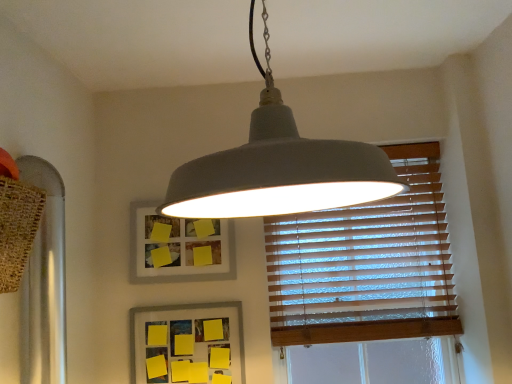
Describe the element at coordinates (177, 244) in the screenshot. I see `matte gray picture frame at upper center, which is the first picture frame in top-to-bottom order` at that location.

What do you see at coordinates (279, 169) in the screenshot? The height and width of the screenshot is (384, 512). I see `matte gray lampshade at center` at bounding box center [279, 169].

Image resolution: width=512 pixels, height=384 pixels. I want to click on matte gray picture frame at upper center, which is the second picture frame in bottom-to-top order, so click(177, 244).

Does matte gray picture frame at upper center, which is the first picture frame in top-to-bottom order, lie in front of matte gray lampshade at center?

No, the depth of matte gray picture frame at upper center, which is the first picture frame in top-to-bottom order, is greater than that of matte gray lampshade at center.

Between matte gray picture frame at upper center, which is the second picture frame in bottom-to-top order, and matte gray lampshade at center, which one has less height?

With less height is matte gray picture frame at upper center, which is the second picture frame in bottom-to-top order.

Is matte gray lampshade at center inside matte gray picture frame at upper center, which is the second picture frame in bottom-to-top order?

No, matte gray lampshade at center is located outside of matte gray picture frame at upper center, which is the second picture frame in bottom-to-top order.

Is wooden blinds at upper right shorter than yellow paper at lower center, the 2th picture frame positioned from the top?

In fact, wooden blinds at upper right may be taller than yellow paper at lower center, the 2th picture frame positioned from the top.

Does wooden blinds at upper right turn towards yellow paper at lower center, which is the first picture frame from bottom to top?

No, wooden blinds at upper right is not aimed at yellow paper at lower center, which is the first picture frame from bottom to top.

From a real-world perspective, between wooden blinds at upper right and yellow paper at lower center, which is the first picture frame from bottom to top, who is vertically lower?

In real-world perspective, yellow paper at lower center, which is the first picture frame from bottom to top, is lower.

Can you tell me how much wooden blinds at upper right and yellow paper at lower center, the 2th picture frame positioned from the top, differ in facing direction?

The angular difference between wooden blinds at upper right and yellow paper at lower center, the 2th picture frame positioned from the top, is 0.257 degrees.

Is yellow paper at lower center, the 2th picture frame positioned from the top, located outside matte gray lampshade at center?

That's correct, yellow paper at lower center, the 2th picture frame positioned from the top, is outside of matte gray lampshade at center.

Which is closer to the camera, (158, 315) or (315, 143)?

The point (315, 143) is more forward.

Considering the sizes of objects yellow paper at lower center, which is the first picture frame from bottom to top, and matte gray lampshade at center in the image provided, who is wider, yellow paper at lower center, which is the first picture frame from bottom to top, or matte gray lampshade at center?

With larger width is matte gray lampshade at center.

Is wooden blinds at upper right smaller than matte gray picture frame at upper center, which is the first picture frame in top-to-bottom order?

Incorrect, wooden blinds at upper right is not smaller in size than matte gray picture frame at upper center, which is the first picture frame in top-to-bottom order.

How different are the orientations of wooden blinds at upper right and matte gray picture frame at upper center, which is the second picture frame in bottom-to-top order, in degrees?

wooden blinds at upper right and matte gray picture frame at upper center, which is the second picture frame in bottom-to-top order, are facing 0.314 degrees away from each other.

From a real-world perspective, is wooden blinds at upper right over matte gray picture frame at upper center, which is the first picture frame in top-to-bottom order?

Actually, wooden blinds at upper right is physically below matte gray picture frame at upper center, which is the first picture frame in top-to-bottom order, in the real world.

Is wooden blinds at upper right located outside matte gray picture frame at upper center, which is the first picture frame in top-to-bottom order?

Yes.

From the picture: From a real-world perspective, who is located lower, yellow paper at lower center, which is the first picture frame from bottom to top, or wooden blinds at upper right?

yellow paper at lower center, which is the first picture frame from bottom to top.

Does point (237, 381) come farther from viewer compared to point (373, 261)?

No, (237, 381) is in front of (373, 261).

Relative to wooden blinds at upper right, is yellow paper at lower center, the 2th picture frame positioned from the top, in front or behind?

yellow paper at lower center, the 2th picture frame positioned from the top, is positioned closer to the viewer than wooden blinds at upper right.

At what (x,y) coordinates should I click in order to perform the action: click on the 2nd picture frame in front of the wooden blinds at upper right, counting from the anchor's position. Please return your answer as a coordinate pair (x, y). Looking at the image, I should click on (187, 344).

Which picture frame is the 1st one when counting from the front of the wooden blinds at upper right? Please provide its 2D coordinates.

[(177, 244)]

Would you consider matte gray picture frame at upper center, which is the first picture frame in top-to-bottom order, to be distant from wooden blinds at upper right?

No, matte gray picture frame at upper center, which is the first picture frame in top-to-bottom order, is not far from wooden blinds at upper right.

Consider the image. Would you say matte gray picture frame at upper center, which is the second picture frame in bottom-to-top order, is to the left or to the right of wooden blinds at upper right in the picture?

matte gray picture frame at upper center, which is the second picture frame in bottom-to-top order, is to the left of wooden blinds at upper right.

Could you tell me if matte gray lampshade at center is turned towards yellow paper at lower center, the 2th picture frame positioned from the top?

No.

Between matte gray lampshade at center and yellow paper at lower center, the 2th picture frame positioned from the top, which one has more height?

Standing taller between the two is matte gray lampshade at center.

Can we say matte gray lampshade at center lies outside yellow paper at lower center, which is the first picture frame from bottom to top?

Yes, matte gray lampshade at center is outside of yellow paper at lower center, which is the first picture frame from bottom to top.

From a real-world perspective, count 1st picture frames downward from the matte gray lampshade at center and point to it. Please provide its 2D coordinates.

[(177, 244)]

Find the location of a particular element. The image size is (512, 384). window blind that appears above the yellow paper at lower center, the 2th picture frame positioned from the top (from a real-world perspective) is located at coordinates (x=366, y=264).

Which object lies nearer to the anchor point matte gray lampshade at center, yellow paper at lower center, which is the first picture frame from bottom to top, or wooden blinds at upper right?

wooden blinds at upper right lies closer to matte gray lampshade at center than the other object.

Looking at the image, which one is located closer to wooden blinds at upper right, matte gray lampshade at center or yellow paper at lower center, which is the first picture frame from bottom to top?

yellow paper at lower center, which is the first picture frame from bottom to top, lies closer to wooden blinds at upper right than the other object.

From the image, which object appears to be farther from yellow paper at lower center, the 2th picture frame positioned from the top, matte gray lampshade at center or wooden blinds at upper right?

Among the two, matte gray lampshade at center is located further to yellow paper at lower center, the 2th picture frame positioned from the top.

In the scene shown: From the image, which object appears to be nearer to yellow paper at lower center, the 2th picture frame positioned from the top, matte gray picture frame at upper center, which is the first picture frame in top-to-bottom order, or wooden blinds at upper right?

matte gray picture frame at upper center, which is the first picture frame in top-to-bottom order, is positioned closer to the anchor yellow paper at lower center, the 2th picture frame positioned from the top.

Estimate the real-world distances between objects in this image. Which object is closer to matte gray lampshade at center, wooden blinds at upper right or yellow paper at lower center, which is the first picture frame from bottom to top?

wooden blinds at upper right.

Which object lies nearer to the anchor point matte gray picture frame at upper center, which is the second picture frame in bottom-to-top order, wooden blinds at upper right or yellow paper at lower center, the 2th picture frame positioned from the top?

yellow paper at lower center, the 2th picture frame positioned from the top, is closer to matte gray picture frame at upper center, which is the second picture frame in bottom-to-top order.

Consider the image. Estimate the real-world distances between objects in this image. Which object is further from wooden blinds at upper right, matte gray picture frame at upper center, which is the first picture frame in top-to-bottom order, or yellow paper at lower center, which is the first picture frame from bottom to top?

matte gray picture frame at upper center, which is the first picture frame in top-to-bottom order.

Based on their spatial positions, is wooden blinds at upper right or matte gray lampshade at center further from matte gray picture frame at upper center, which is the first picture frame in top-to-bottom order?

matte gray lampshade at center lies further to matte gray picture frame at upper center, which is the first picture frame in top-to-bottom order, than the other object.

This screenshot has height=384, width=512. Find the location of `picture frame located between matte gray lampshade at center and matte gray picture frame at upper center, which is the second picture frame in bottom-to-top order, in the depth direction`. picture frame located between matte gray lampshade at center and matte gray picture frame at upper center, which is the second picture frame in bottom-to-top order, in the depth direction is located at coordinates (187, 344).

Where is `picture frame located between matte gray picture frame at upper center, which is the first picture frame in top-to-bottom order, and wooden blinds at upper right in the left-right direction`? This screenshot has height=384, width=512. picture frame located between matte gray picture frame at upper center, which is the first picture frame in top-to-bottom order, and wooden blinds at upper right in the left-right direction is located at coordinates (187, 344).